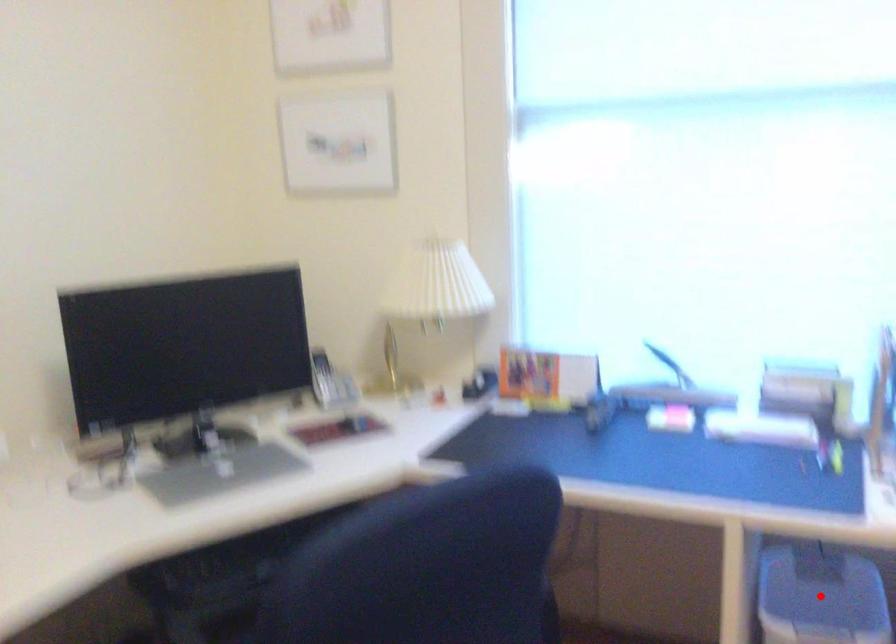
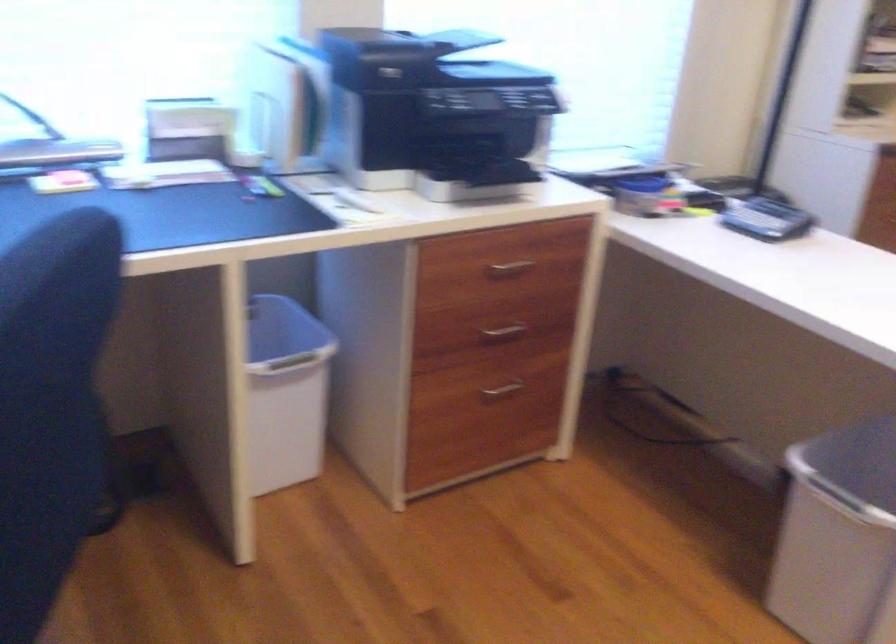
Question: I am providing you with two images of the same scene from different viewpoints. A red point is marked on the first image. Is the red point's position out of view in image 2?

Choices:
 (A) Yes
 (B) No

Answer: (A)